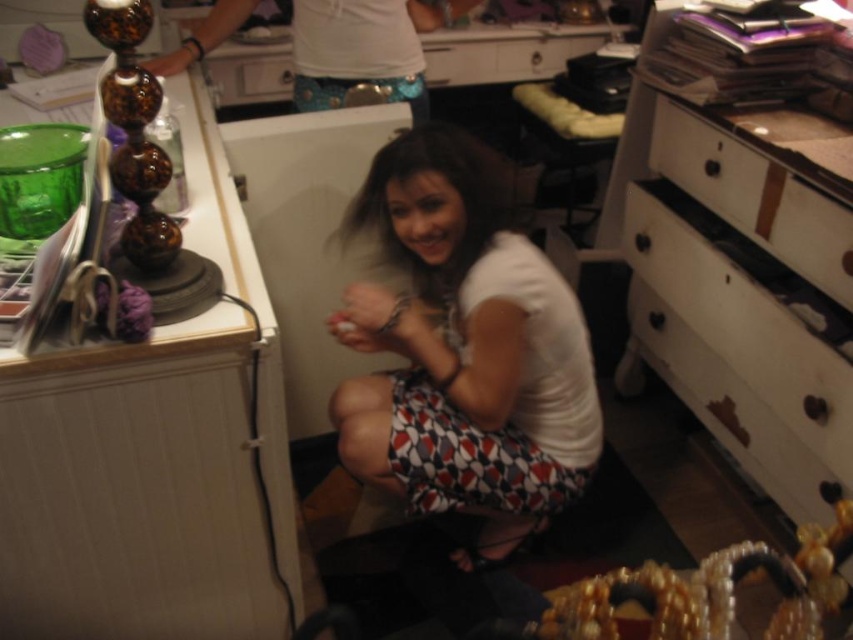
Based on the photo, can you confirm if white wood drawer at lower right is positioned below white glossy drawer at upper center?

Indeed, white wood drawer at lower right is positioned under white glossy drawer at upper center.

Who is shorter, white wood drawer at lower right or white glossy drawer at upper center?

white glossy drawer at upper center

Who is more forward, (746, 323) or (260, 90)?

Positioned in front is point (746, 323).

Locate an element on the screen. The height and width of the screenshot is (640, 853). white wood drawer at lower right is located at coordinates (746, 314).

Between white painted wood dresser at right and white wood drawer at center, which one is positioned higher?

Positioned higher is white wood drawer at center.

At what (x,y) coordinates should I click in order to perform the action: click on white painted wood dresser at right. Please return your answer as a coordinate pair (x, y). The width and height of the screenshot is (853, 640). Looking at the image, I should click on (738, 296).

This screenshot has width=853, height=640. In order to click on white painted wood dresser at right in this screenshot , I will do `click(738, 296)`.

Does point (442, 154) come closer to viewer compared to point (265, 61)?

Yes, it is in front of point (265, 61).

Between white cotton shirt at center and white glossy drawer at upper center, which one appears on the right side from the viewer's perspective?

Positioned to the right is white cotton shirt at center.

In order to click on white cotton shirt at center in this screenshot , I will do `click(463, 348)`.